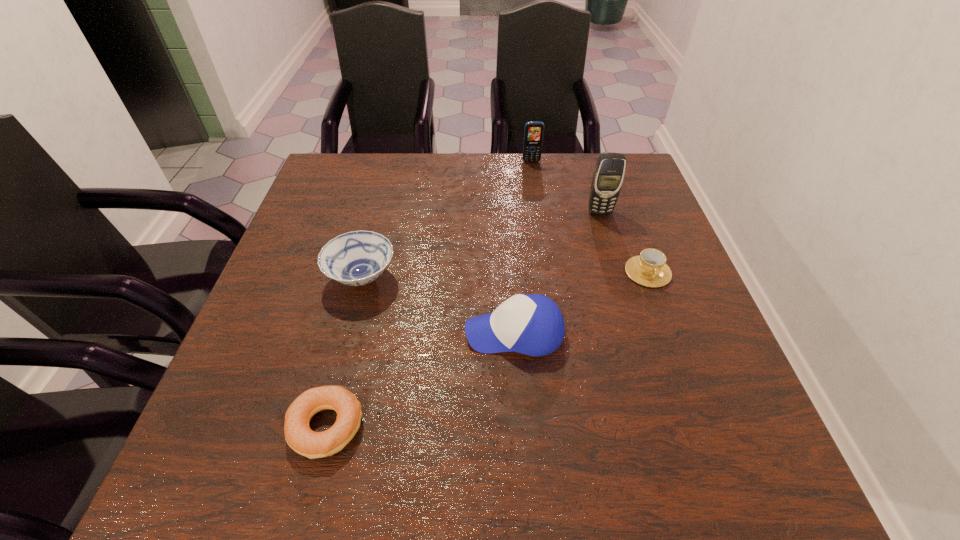
Where is `object that ranks as the closest to the cup`? The width and height of the screenshot is (960, 540). object that ranks as the closest to the cup is located at coordinates (608, 176).

Identify the location of free space that satisfies the following two spatial constraints: 1. on the front face of the fifth nearest object; 2. on the front-facing side of the second nearest object. (636, 333).

Find the location of a particular element. vacant region that satisfies the following two spatial constraints: 1. on the screen of the farther cellular telephone; 2. on the front-facing side of the fifth farthest object is located at coordinates (557, 333).